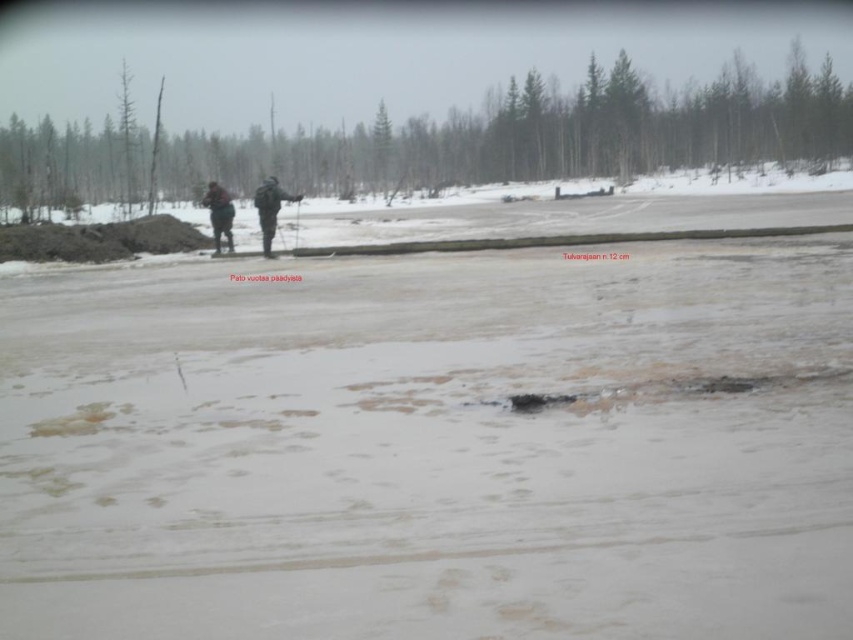
Question: Which of these objects is positioned closest to the brown leather jacket at upper center?

Choices:
 (A) dark green camouflage jacket at center
 (B) translucent ice at center
 (C) dark gray jacket at center

Answer: (C)

Question: Is dark gray jacket at center further to the viewer compared to dark green camouflage jacket at center?

Choices:
 (A) yes
 (B) no

Answer: (B)

Question: Is translucent ice at center thinner than brown leather jacket at upper center?

Choices:
 (A) no
 (B) yes

Answer: (A)

Question: Is dark gray jacket at center further to camera compared to brown leather jacket at upper center?

Choices:
 (A) no
 (B) yes

Answer: (A)

Question: Which object appears closest to the camera in this image?

Choices:
 (A) brown leather jacket at upper center
 (B) dark green camouflage jacket at center

Answer: (B)

Question: Among these points, which one is farthest from the camera?

Choices:
 (A) (231, 216)
 (B) (264, 216)
 (C) (213, 193)

Answer: (A)